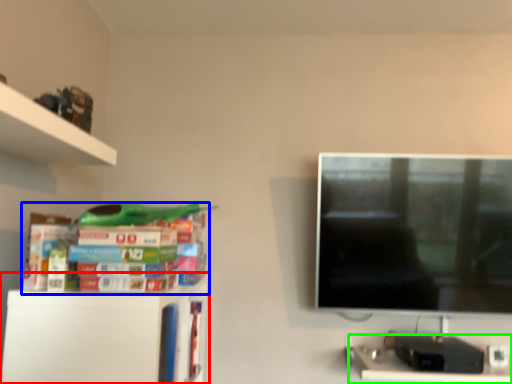
Question: Estimate the real-world distances between objects in this image. Which object is farther from shelf (highlighted by a red box), book (highlighted by a blue box) or computer desk (highlighted by a green box)?

Choices:
 (A) book
 (B) computer desk

Answer: (B)